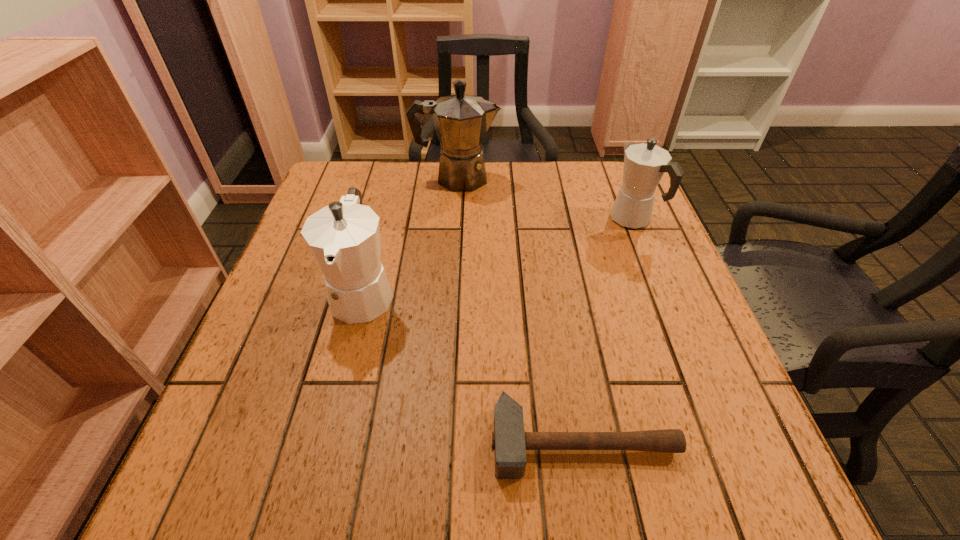
The width and height of the screenshot is (960, 540). Find the location of `the third closest object relative to the rightmost coffeepot`. the third closest object relative to the rightmost coffeepot is located at coordinates (344, 237).

Identify which object is the second nearest to the farthest object. Please provide its 2D coordinates. Your answer should be formatted as a tuple, i.e. [(x, y)], where the tuple contains the x and y coordinates of a point satisfying the conditions above.

[(644, 164)]

Locate an element on the screen. This screenshot has height=540, width=960. the second closest coffeepot to the third farthest object is located at coordinates (644, 164).

At what (x,y) coordinates should I click in order to perform the action: click on coffeepot that is the second closest to the farthest coffeepot. Please return your answer as a coordinate pair (x, y). Looking at the image, I should click on (644, 164).

This screenshot has height=540, width=960. What are the coordinates of `vacant region that satisfies the following two spatial constraints: 1. on the pouring side of the farthest coffeepot; 2. at the spout of the second nearest object` in the screenshot? It's located at (448, 292).

Locate an element on the screen. free location that satisfies the following two spatial constraints: 1. on the pouring side of the farthest coffeepot; 2. at the spout of the nearest coffeepot is located at coordinates (448, 292).

In order to click on free space that satisfies the following two spatial constraints: 1. on the pouring side of the second farthest object; 2. on the left side of the farthest coffeepot in this screenshot , I will do `click(454, 220)`.

Locate an element on the screen. The height and width of the screenshot is (540, 960). free spot that satisfies the following two spatial constraints: 1. on the back side of the rightmost coffeepot; 2. on the pouring side of the farthest object is located at coordinates 616,178.

At what (x,y) coordinates should I click in order to perform the action: click on vacant space that satisfies the following two spatial constraints: 1. on the pouring side of the farthest coffeepot; 2. at the spout of the third farthest object. Please return your answer as a coordinate pair (x, y). This screenshot has width=960, height=540. Looking at the image, I should click on (448, 292).